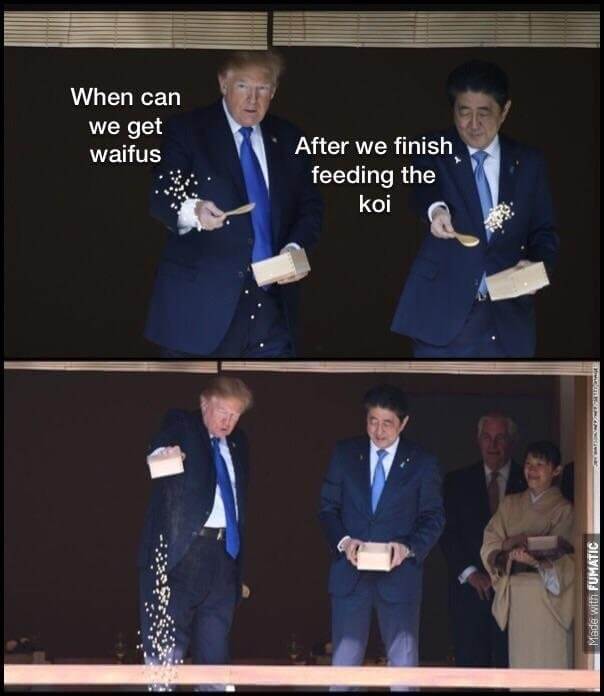
Where is `blinds`? The image size is (604, 696). blinds is located at coordinates (208, 24), (399, 40), (327, 365), (141, 365).